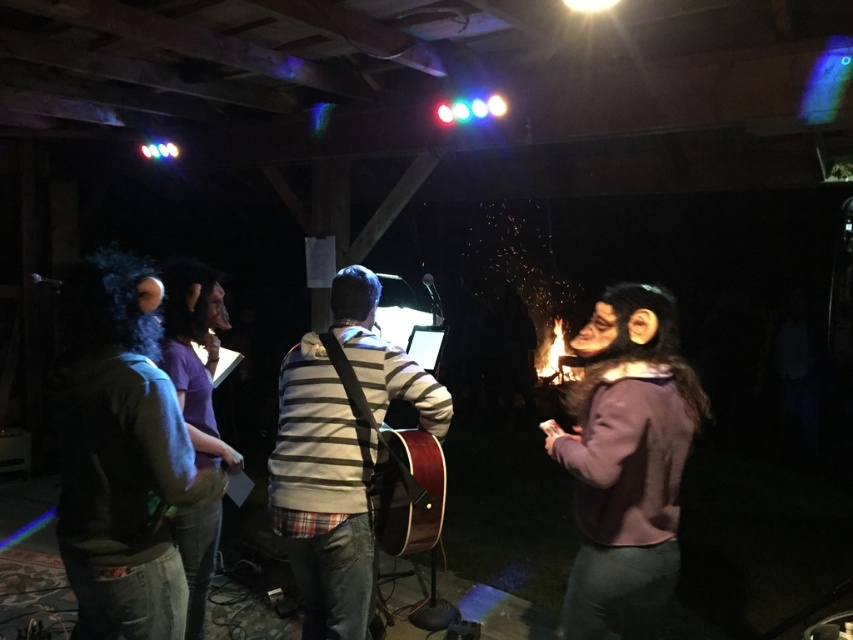
You are standing at the center of the room and want to move to the point marked at coordinates point (625, 461). Is this point located on the purple fleece sweater at right?

Yes, the point (625, 461) is located on the purple fleece sweater at right.

You are standing at the center of the room and see a point marked at coordinates (625, 461). What object is located at that point?

The point at coordinates (625, 461) indicates the purple fleece sweater at right.

You are organizing a photo shoot and need to ensure that the striped sweater at center and the wooden acoustic guitar at center are both visible in the frame. Given that the camera can only focus on objects within a certain size range, which object might require adjustment to ensure it fits properly within the frame?

The striped sweater at center is larger in size than the wooden acoustic guitar at center, so the camera might need to adjust its focus or zoom to accommodate the larger size of the striped sweater at center.